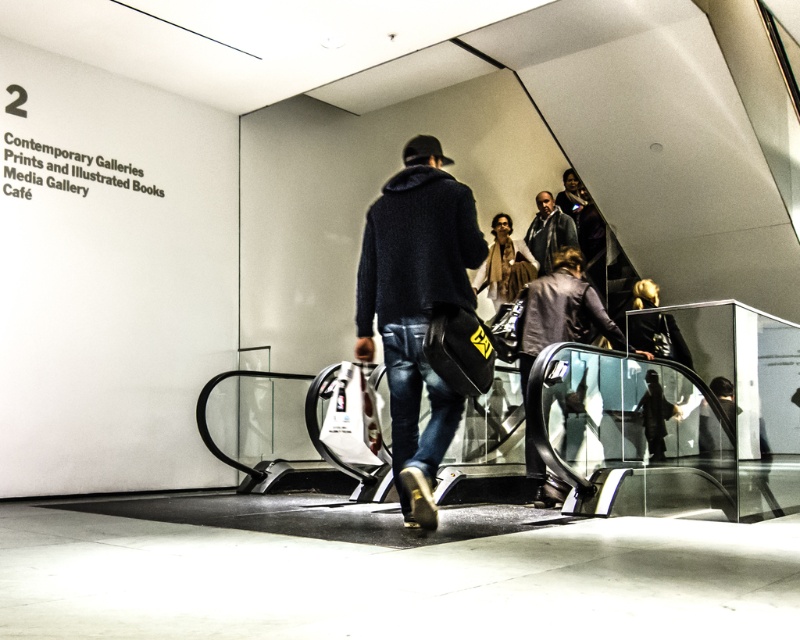
Question: Which point is closer to the camera taking this photo?

Choices:
 (A) (377, 209)
 (B) (570, 320)
 (C) (498, 218)

Answer: (A)

Question: Can you confirm if dark brown leather jacket at upper center is positioned to the right of brown scarf at center?

Choices:
 (A) no
 (B) yes

Answer: (B)

Question: Is dark blue sweater at center thinner than dark gray hoodie at upper center?

Choices:
 (A) yes
 (B) no

Answer: (B)

Question: Considering the real-world distances, which object is closest to the dark gray hoodie at upper center?

Choices:
 (A) dark blue sweater at center
 (B) brown scarf at center
 (C) dark brown leather jacket at upper center

Answer: (B)

Question: Is dark blue sweater at center smaller than dark brown leather jacket at upper center?

Choices:
 (A) no
 (B) yes

Answer: (B)

Question: Which object is positioned farthest from the dark blue sweater at center?

Choices:
 (A) dark gray hoodie at upper center
 (B) dark brown leather jacket at upper center
 (C) brown scarf at center

Answer: (A)